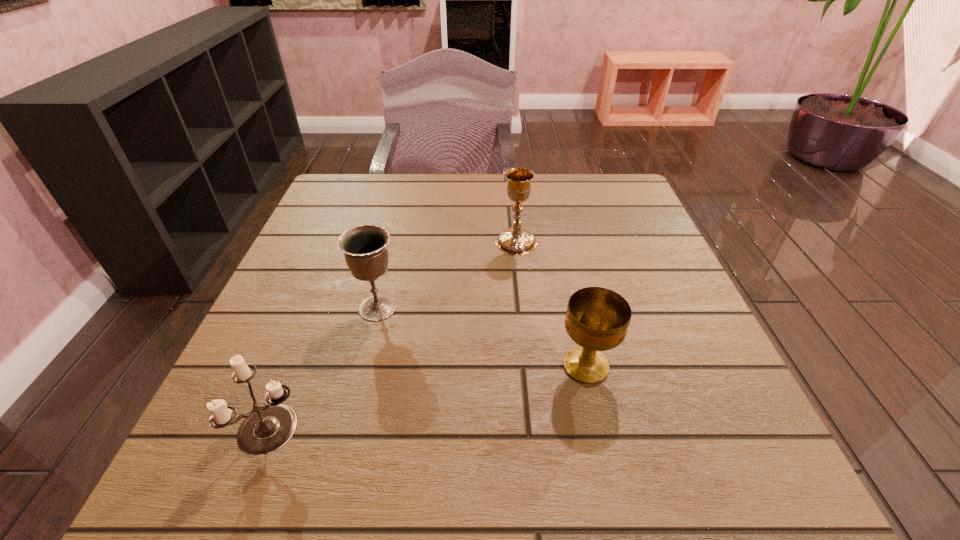
What are the coordinates of `free region located on the left of the nearest chalice` in the screenshot? It's located at (418, 366).

Find the location of a particular element. Image resolution: width=960 pixels, height=540 pixels. free point located on the right of the candle holder is located at coordinates pos(458,428).

Where is `object situated at the near edge`? This screenshot has width=960, height=540. object situated at the near edge is located at coordinates (265, 429).

You are a GUI agent. You are given a task and a screenshot of the screen. Output one action in this format:
    pyautogui.click(x=<x>, y=<y>)
    Task: Click on the object present at the left edge
    This screenshot has width=960, height=540.
    Given the screenshot: What is the action you would take?
    pyautogui.click(x=265, y=429)

I want to click on object present at the near left corner, so click(265, 429).

Image resolution: width=960 pixels, height=540 pixels. Find the location of `vacant point at the far edge`. vacant point at the far edge is located at coordinates (468, 193).

In the image, there is a desktop. At what (x,y) coordinates should I click in order to perform the action: click on vacant space at the near edge. Please return your answer as a coordinate pair (x, y). This screenshot has width=960, height=540. Looking at the image, I should click on pyautogui.click(x=367, y=456).

Identify the location of vacant space at the left edge of the desktop. Image resolution: width=960 pixels, height=540 pixels. (317, 233).

You are a GUI agent. You are given a task and a screenshot of the screen. Output one action in this format:
    pyautogui.click(x=<x>, y=<y>)
    Task: Click on the free location at the right edge
    
    Given the screenshot: What is the action you would take?
    pyautogui.click(x=623, y=247)

Locate an element on the screen. vacant area at the far left corner of the desktop is located at coordinates (358, 193).